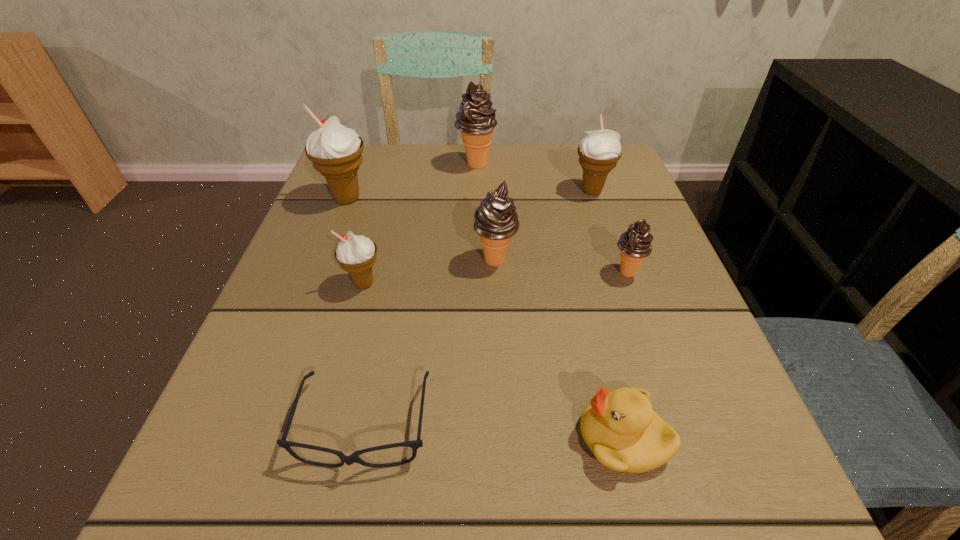
Identify the location of free region located 0.240m on the front of the farthest object. (475, 239).

At what (x,y) coordinates should I click in order to perform the action: click on vacant space located on the front of the biggest white icecream. Please return your answer as a coordinate pair (x, y). Image resolution: width=960 pixels, height=540 pixels. Looking at the image, I should click on (318, 275).

Locate an element on the screen. The height and width of the screenshot is (540, 960). vacant space located 0.310m on the left of the rightmost white icecream is located at coordinates point(436,191).

This screenshot has width=960, height=540. Find the location of `free space located 0.350m on the front of the second smallest chocolate icecream`. free space located 0.350m on the front of the second smallest chocolate icecream is located at coordinates (503, 467).

Where is `vacant space located 0.080m on the back of the smallest white icecream`? Image resolution: width=960 pixels, height=540 pixels. vacant space located 0.080m on the back of the smallest white icecream is located at coordinates (375, 243).

This screenshot has width=960, height=540. I want to click on vacant space located on the back of the smallest chocolate icecream, so click(610, 223).

Find the location of a particular element. vacant space located 0.380m on the front-facing side of the duckling is located at coordinates (293, 438).

Identify the location of vacant space positioned on the front-facing side of the duckling. The height and width of the screenshot is (540, 960). (444, 438).

This screenshot has height=540, width=960. What are the coordinates of `vacant position located 0.280m on the front-facing side of the duckling` in the screenshot? It's located at (369, 438).

Identify the location of duckling located in the near edge section of the desktop. (620, 428).